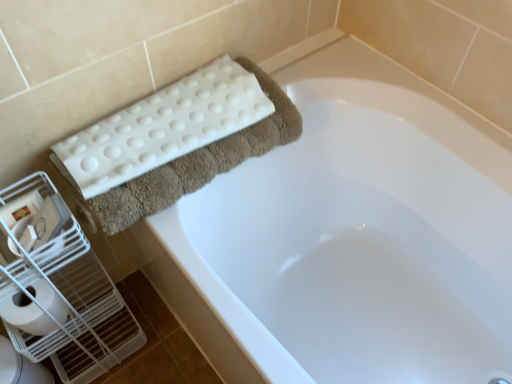
Measure the distance between white textured bath towel at upper left and camera.

The depth of white textured bath towel at upper left is 29.09 inches.

What do you see at coordinates (411, 136) in the screenshot? I see `white rubber mat at upper left` at bounding box center [411, 136].

Image resolution: width=512 pixels, height=384 pixels. What do you see at coordinates (26, 315) in the screenshot? I see `white matte toilet paper at lower left` at bounding box center [26, 315].

This screenshot has height=384, width=512. Describe the element at coordinates (20, 367) in the screenshot. I see `white glossy toilet bowl at lower left` at that location.

Locate an element on the screen. This screenshot has height=384, width=512. white plastic bird cage at left is located at coordinates (58, 287).

Does white textured bath towel at upper left appear on the left side of white matte toilet paper at lower left?

No, white textured bath towel at upper left is not to the left of white matte toilet paper at lower left.

Is white textured bath towel at upper left not within white matte toilet paper at lower left?

Yes, white textured bath towel at upper left is outside of white matte toilet paper at lower left.

Is white textured bath towel at upper left facing away from white matte toilet paper at lower left?

white textured bath towel at upper left does not have its back to white matte toilet paper at lower left.

Is white textured bath towel at upper left wider than white matte toilet paper at lower left?

Yes, white textured bath towel at upper left is wider than white matte toilet paper at lower left.

Is white matte toilet paper at lower left at the back of white rubber mat at upper left?

white rubber mat at upper left does not have its back to white matte toilet paper at lower left.

From a real-world perspective, is white rubber mat at upper left beneath white matte toilet paper at lower left?

Indeed, from a real-world perspective, white rubber mat at upper left is positioned beneath white matte toilet paper at lower left.

Looking at this image, which object is closer to the camera, white rubber mat at upper left or white matte toilet paper at lower left?

white rubber mat at upper left.

Can you tell me how much white rubber mat at upper left and white plastic bird cage at left differ in facing direction?

89.2 degrees separate the facing orientations of white rubber mat at upper left and white plastic bird cage at left.

Considering the relative positions of white rubber mat at upper left and white plastic bird cage at left in the image provided, is white rubber mat at upper left to the right of white plastic bird cage at left from the viewer's perspective?

Indeed, white rubber mat at upper left is positioned on the right side of white plastic bird cage at left.

Which object is further away from the camera taking this photo, white rubber mat at upper left or white plastic bird cage at left?

white plastic bird cage at left is further from the camera.

How far apart are white matte toilet paper at lower left and white textured bath towel at upper left?

A distance of 14.45 inches exists between white matte toilet paper at lower left and white textured bath towel at upper left.

From a real-world perspective, which is physically above, white matte toilet paper at lower left or white textured bath towel at upper left?

white textured bath towel at upper left.

Does white matte toilet paper at lower left contain white textured bath towel at upper left?

No, white textured bath towel at upper left is not surrounded by white matte toilet paper at lower left.

Based on the photo, looking at their sizes, would you say white glossy toilet bowl at lower left is wider or thinner than white textured bath towel at upper left?

Clearly, white glossy toilet bowl at lower left has less width compared to white textured bath towel at upper left.

Is white glossy toilet bowl at lower left oriented towards white textured bath towel at upper left?

No.

Is point (34, 377) behind point (168, 89)?

Yes, it is.

Is the surface of white glossy toilet bowl at lower left in direct contact with white textured bath towel at upper left?

No, white glossy toilet bowl at lower left is not touching white textured bath towel at upper left.

Is white rubber mat at upper left not near white glossy toilet bowl at lower left?

No, there isn't a large distance between white rubber mat at upper left and white glossy toilet bowl at lower left.

From a real-world perspective, who is located lower, white rubber mat at upper left or white glossy toilet bowl at lower left?

white glossy toilet bowl at lower left, from a real-world perspective.

The height and width of the screenshot is (384, 512). Identify the location of toilet bowl below the white rubber mat at upper left (from a real-world perspective). (20, 367).

Which point is more forward, (192, 307) or (45, 375)?

The point (192, 307) is in front.

You are a GUI agent. You are given a task and a screenshot of the screen. Output one action in this format:
    pyautogui.click(x=<x>, y=<y>)
    Task: Click on the bird cage above the white glossy toilet bowl at lower left (from a real-world perspective)
    The image size is (512, 384).
    Given the screenshot: What is the action you would take?
    pyautogui.click(x=58, y=287)

Would you say white glossy toilet bowl at lower left is outside white plastic bird cage at left?

white glossy toilet bowl at lower left lies outside white plastic bird cage at left's area.

Considering the relative sizes of white glossy toilet bowl at lower left and white plastic bird cage at left in the image provided, is white glossy toilet bowl at lower left taller than white plastic bird cage at left?

In fact, white glossy toilet bowl at lower left may be shorter than white plastic bird cage at left.

Considering the relative sizes of white glossy toilet bowl at lower left and white plastic bird cage at left in the image provided, is white glossy toilet bowl at lower left thinner than white plastic bird cage at left?

Incorrect, the width of white glossy toilet bowl at lower left is not less than that of white plastic bird cage at left.

Image resolution: width=512 pixels, height=384 pixels. What are the coordinates of `bath towel above the white matte toilet paper at lower left (from the image's perspective)` in the screenshot? It's located at (163, 127).

Locate an element on the screen. toilet paper on the left of white rubber mat at upper left is located at coordinates (26, 315).

Looking at the image, which one is located closer to white textured bath towel at upper left, white rubber mat at upper left or white matte toilet paper at lower left?

white rubber mat at upper left.

When comparing their distances from white rubber mat at upper left, does white glossy toilet bowl at lower left or white plastic bird cage at left seem closer?

Based on the image, white plastic bird cage at left appears to be nearer to white rubber mat at upper left.

Based on their spatial positions, is white plastic bird cage at left or white rubber mat at upper left closer to white glossy toilet bowl at lower left?

white plastic bird cage at left lies closer to white glossy toilet bowl at lower left than the other object.

Which object lies further to the anchor point white rubber mat at upper left, white matte toilet paper at lower left or white glossy toilet bowl at lower left?

The object further to white rubber mat at upper left is white glossy toilet bowl at lower left.

Which object lies nearer to the anchor point white glossy toilet bowl at lower left, white textured bath towel at upper left or white rubber mat at upper left?

white textured bath towel at upper left is closer to white glossy toilet bowl at lower left.

Estimate the real-world distances between objects in this image. Which object is further from white textured bath towel at upper left, white matte toilet paper at lower left or white glossy toilet bowl at lower left?

Among the two, white glossy toilet bowl at lower left is located further to white textured bath towel at upper left.

When comparing their distances from white textured bath towel at upper left, does white glossy toilet bowl at lower left or white plastic bird cage at left seem closer?

white plastic bird cage at left lies closer to white textured bath towel at upper left than the other object.

Which object lies further to the anchor point white rubber mat at upper left, white plastic bird cage at left or white glossy toilet bowl at lower left?

white glossy toilet bowl at lower left lies further to white rubber mat at upper left than the other object.

The image size is (512, 384). In order to click on bath towel situated between white plastic bird cage at left and white rubber mat at upper left from left to right in this screenshot , I will do `click(163, 127)`.

Locate an element on the screen. Image resolution: width=512 pixels, height=384 pixels. bird cage between white textured bath towel at upper left and white glossy toilet bowl at lower left vertically is located at coordinates (58, 287).

Find the location of a particular element. bird cage between white glossy toilet bowl at lower left and white rubber mat at upper left from left to right is located at coordinates (58, 287).

The width and height of the screenshot is (512, 384). I want to click on bird cage between white matte toilet paper at lower left and white rubber mat at upper left in the horizontal direction, so click(x=58, y=287).